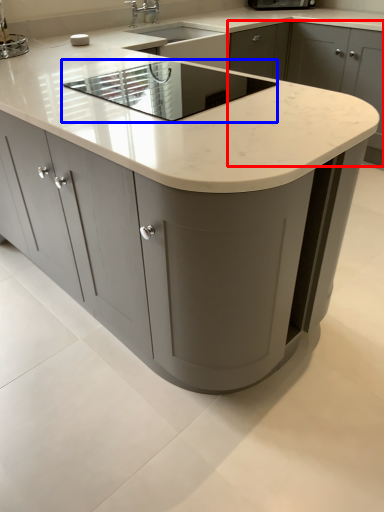
Question: Which object appears farthest to the camera in this image, cabinetry (highlighted by a red box) or appliance (highlighted by a blue box)?

Choices:
 (A) cabinetry
 (B) appliance

Answer: (A)